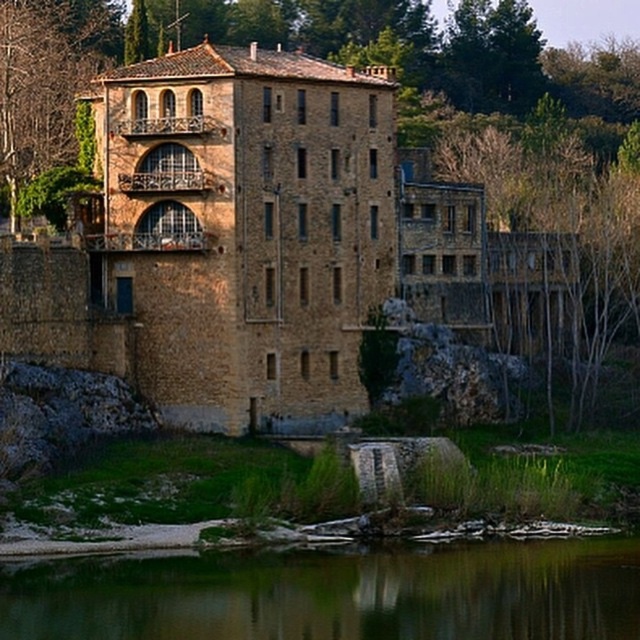
Is green leafy tree at upper center above green leafy tree at upper left?

Yes.

Can you confirm if green leafy tree at upper center is taller than green leafy tree at upper left?

Indeed, green leafy tree at upper center has a greater height compared to green leafy tree at upper left.

Is point (93, 100) behind point (12, 0)?

That is False.

At what (x,y) coordinates should I click in order to perform the action: click on green leafy tree at upper center. Please return your answer as a coordinate pair (x, y). The height and width of the screenshot is (640, 640). Looking at the image, I should click on (x=314, y=236).

Can you confirm if green leafy tree at upper center is shorter than green reflective water at lower center?

No.

Describe the element at coordinates (314, 236) in the screenshot. This screenshot has height=640, width=640. I see `green leafy tree at upper center` at that location.

Identify the location of green leafy tree at upper center. The width and height of the screenshot is (640, 640). (314, 236).

What are the coordinates of `green leafy tree at upper center` in the screenshot? It's located at (314, 236).

Who is higher up, green reflective water at lower center or green leafy tree at upper left?

green leafy tree at upper left is higher up.

Can you confirm if green reflective water at lower center is positioned below green leafy tree at upper left?

Correct, green reflective water at lower center is located below green leafy tree at upper left.

Describe the element at coordinates (333, 593) in the screenshot. I see `green reflective water at lower center` at that location.

Locate an element on the screen. The height and width of the screenshot is (640, 640). green reflective water at lower center is located at coordinates (333, 593).